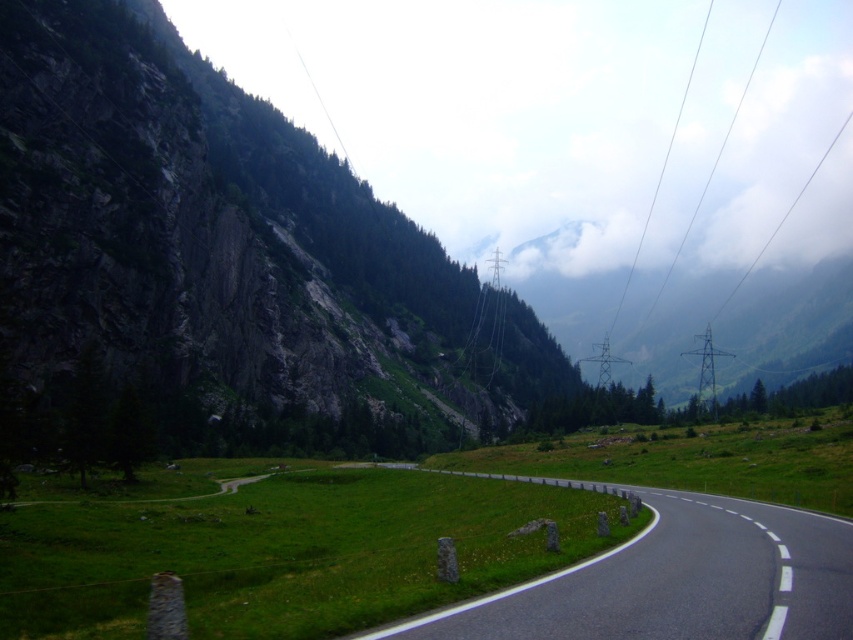
Question: Can you confirm if rugged stone mountain at left is thinner than black asphalt road at center?

Choices:
 (A) no
 (B) yes

Answer: (A)

Question: Observing the image, what is the correct spatial positioning of rugged stone mountain at left in reference to black asphalt road at center?

Choices:
 (A) below
 (B) above

Answer: (B)

Question: Which of the following is the farthest from the observer?

Choices:
 (A) black asphalt road at center
 (B) rugged stone mountain at left

Answer: (B)

Question: Among these objects, which one is nearest to the camera?

Choices:
 (A) black asphalt road at center
 (B) rugged stone mountain at left

Answer: (A)

Question: Does rugged stone mountain at left have a smaller size compared to black asphalt road at center?

Choices:
 (A) no
 (B) yes

Answer: (A)